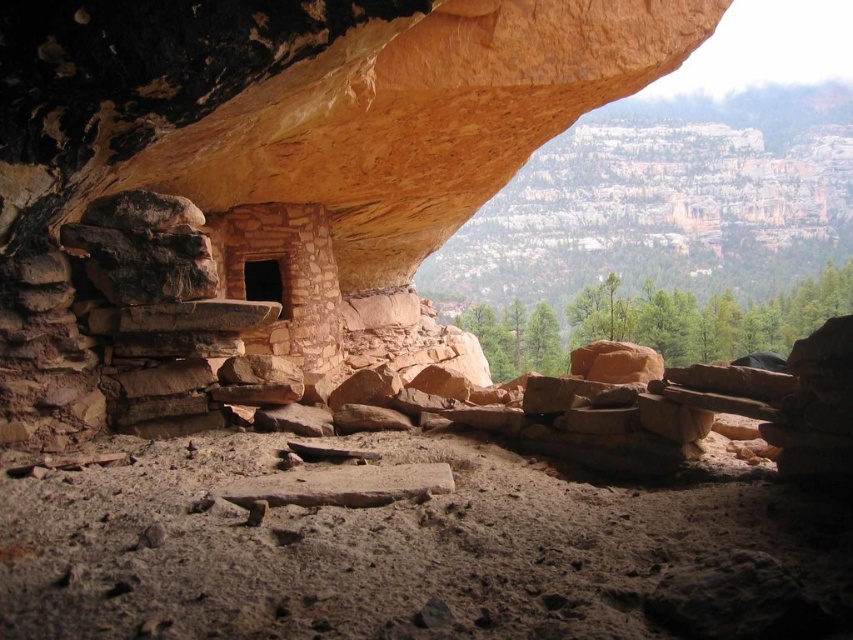
Question: Which point is closer to the camera taking this photo?

Choices:
 (A) (x=252, y=264)
 (B) (x=91, y=211)

Answer: (B)

Question: Can you confirm if rustic stone shelter at center is positioned above brown stone cave at center?

Choices:
 (A) yes
 (B) no

Answer: (A)

Question: Observing the image, what is the correct spatial positioning of rustic stone shelter at center in reference to brown stone cave at center?

Choices:
 (A) left
 (B) right

Answer: (B)

Question: Can you confirm if rustic stone shelter at center is positioned to the left of brown stone cave at center?

Choices:
 (A) yes
 (B) no

Answer: (B)